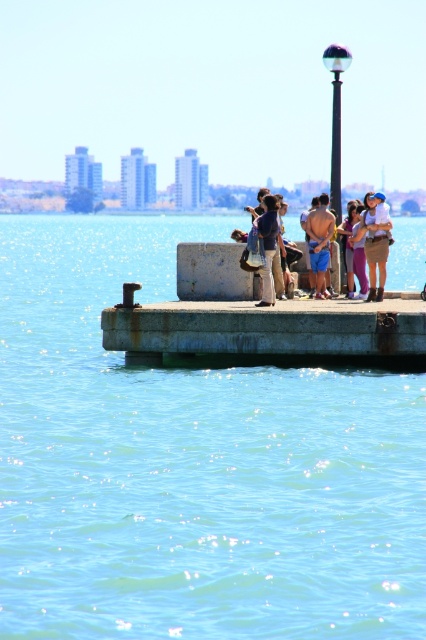
Question: Is denim jacket at center above dark blue shirt at center?

Choices:
 (A) yes
 (B) no

Answer: (A)

Question: Based on their relative distances, which object is farther from the denim jacket at center?

Choices:
 (A) dark blue shirt at center
 (B) shiny glass lamp post at upper center
 (C) blue water at center
 (D) rusty concrete dock at center

Answer: (B)

Question: Is rusty concrete dock at center closer to camera compared to dark blue shirt at center?

Choices:
 (A) yes
 (B) no

Answer: (A)

Question: Estimate the real-world distances between objects in this image. Which object is farther from the dark blue shirt at center?

Choices:
 (A) blue water at center
 (B) shiny blue shorts at center

Answer: (A)

Question: Is blue water at center closer to the viewer compared to denim jacket at center?

Choices:
 (A) yes
 (B) no

Answer: (A)

Question: Which object appears farthest from the camera in this image?

Choices:
 (A) denim jacket at center
 (B) shiny blue shorts at center

Answer: (B)